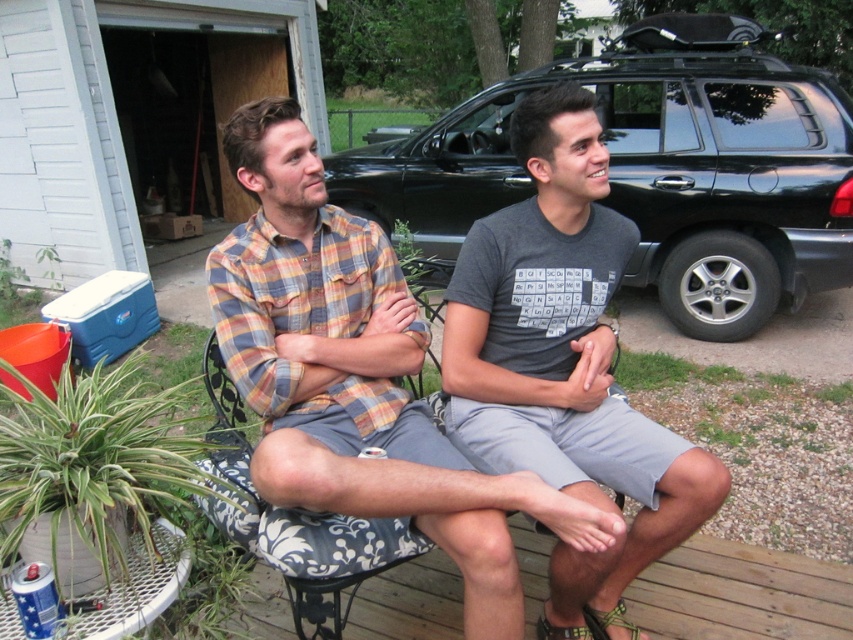
Can you confirm if black matte suv at upper right is bigger than gray fabric shirt at center?

Correct, black matte suv at upper right is larger in size than gray fabric shirt at center.

Which of these two, black matte suv at upper right or gray fabric shirt at center, stands taller?

black matte suv at upper right is taller.

Does point (723, 268) come closer to viewer compared to point (540, 456)?

No, (723, 268) is behind (540, 456).

In order to click on black matte suv at upper right in this screenshot , I will do `click(656, 170)`.

Is black matte suv at upper right further to the viewer compared to plaid cotton shirt at center?

Yes, it is behind plaid cotton shirt at center.

Measure the distance from black matte suv at upper right to plaid cotton shirt at center.

black matte suv at upper right is 3.31 meters from plaid cotton shirt at center.

Measure the distance between black matte suv at upper right and camera.

black matte suv at upper right is 4.09 meters away from camera.

Where is `black matte suv at upper right`? This screenshot has height=640, width=853. black matte suv at upper right is located at coordinates (656, 170).

Measure the distance between plaid cotton shirt at center and camera.

A distance of 4.50 feet exists between plaid cotton shirt at center and camera.

Which is below, plaid cotton shirt at center or gray fabric shirt at center?

gray fabric shirt at center is below.

Find the location of a particular element. plaid cotton shirt at center is located at coordinates click(357, 376).